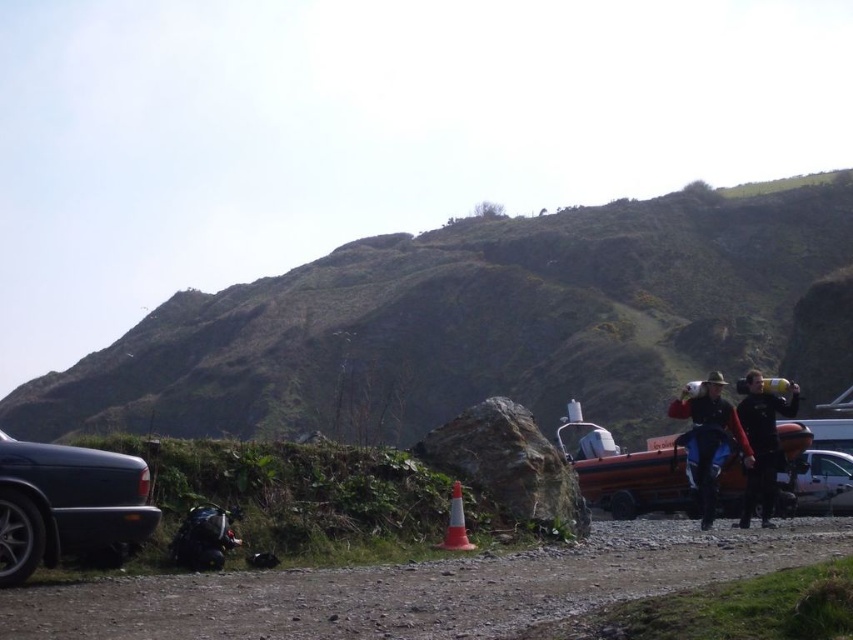
You are standing at the point with coordinates point (672, 307) and want to walk to the point with coordinates point (42, 524). Which direction should you move to get closer to your destination?

You should move away from the viewer because point (672, 307) is further to the viewer than point (42, 524).

You are a hiker who wants to take a photo of the shiny metallic car at lower left from the green grassy hillside at upper center. Is the car visible from the hillside?

The green grassy hillside at upper center is positioned on the left side of the shiny metallic car at lower left, so the car is likely visible from the hillside as they are positioned next to each other.